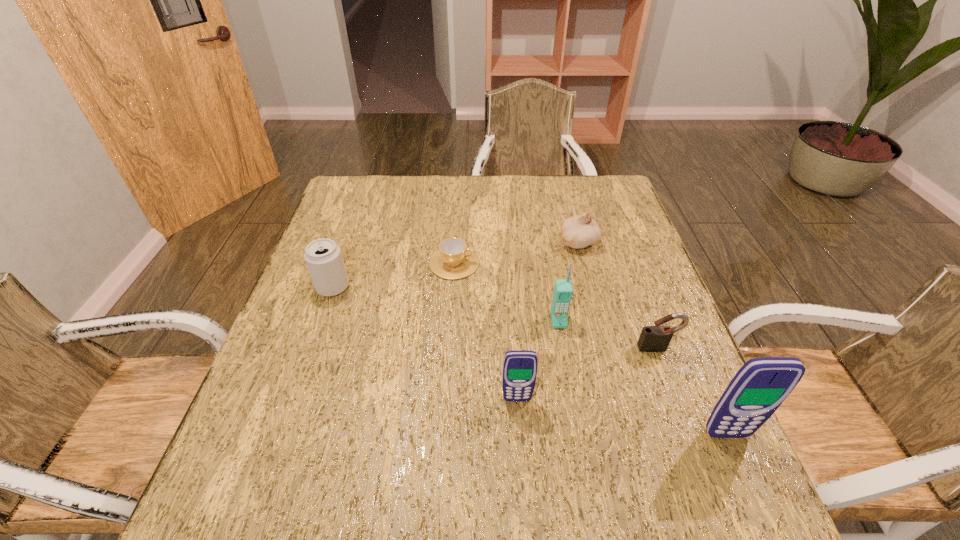
Find the location of a particular element. The height and width of the screenshot is (540, 960). cellular telephone that is the second closest to the second nearest object is located at coordinates (761, 385).